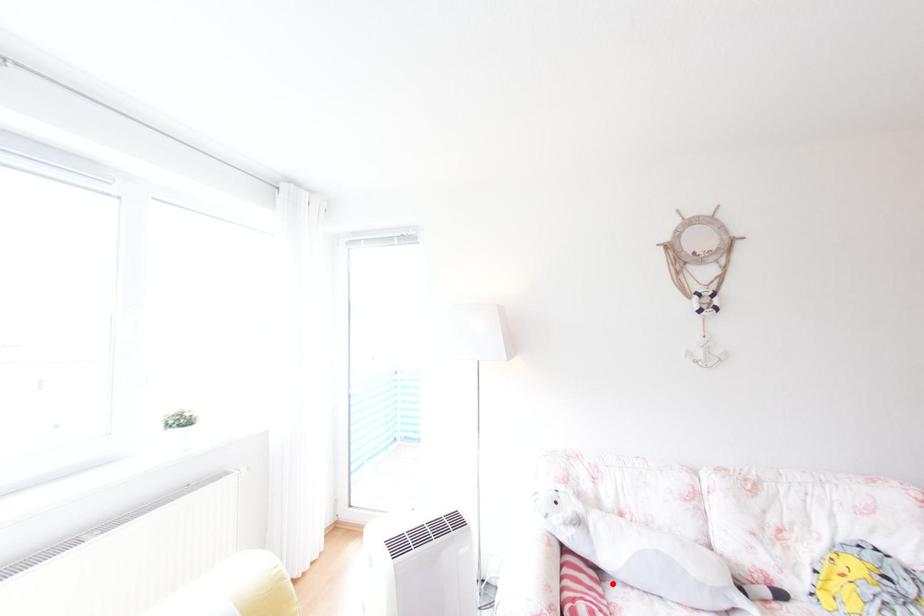
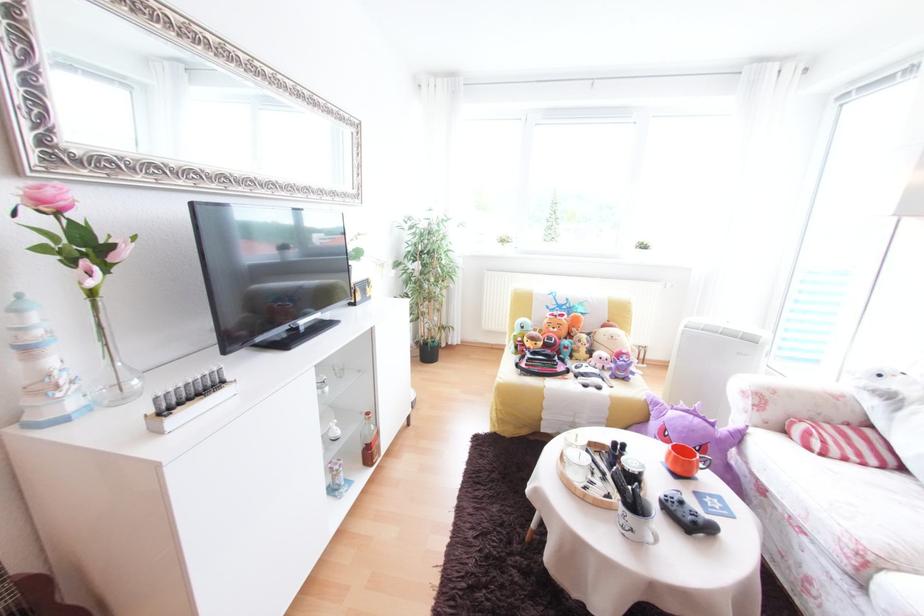
Where in the second image is the point corresponding to the highlighted location from the first image?

(907, 472)